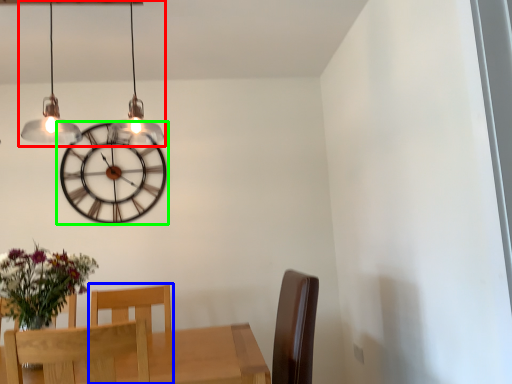
Question: Which is nearer to the lamp (highlighted by a red box)? chair (highlighted by a blue box) or wall clock (highlighted by a green box).

Choices:
 (A) chair
 (B) wall clock

Answer: (B)